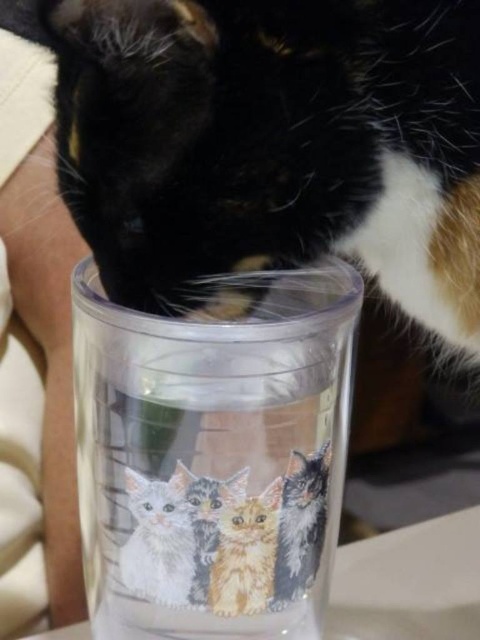
You are a photographer trying to capture a close shot of the calico fur cat at center and the white fur cat at lower center. Since you want to focus on the larger cat, which one should you adjust your camera to focus on?

The calico fur cat at center is larger than the white fur cat at lower center, so you should focus your camera on the calico fur cat at center.

You are a photographer trying to capture the calico fur cat at center and the white fur cat at lower center in the same frame. Based on their positions, which cat should you adjust your camera angle to focus on first to ensure both are in the shot?

The calico fur cat at center is to the right of the white fur cat at lower center, so you should focus on the white fur cat at lower center first to ensure both are in the frame.